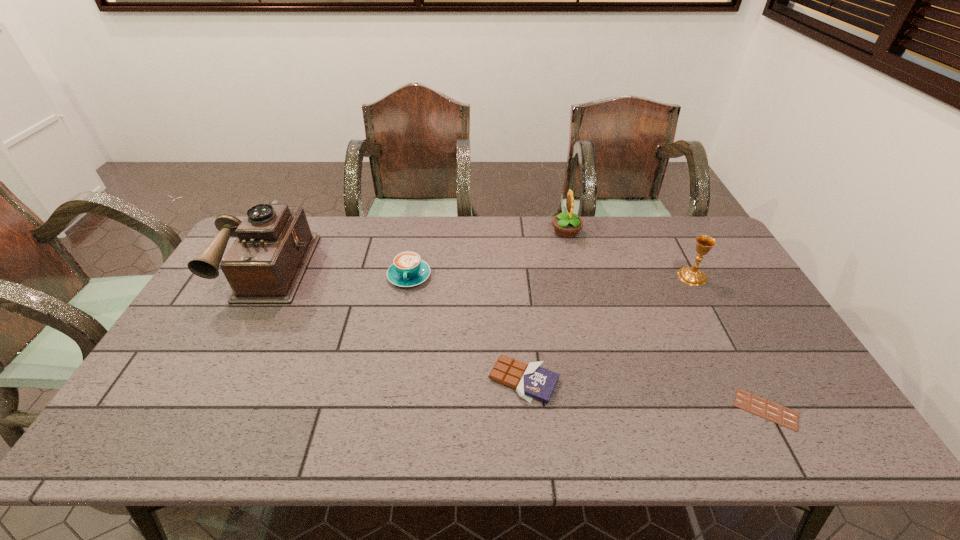
This screenshot has height=540, width=960. In order to click on vacant region that satisfies the following two spatial constraints: 1. on the face of the fourth object from left to right; 2. on the left side of the chalice in this screenshot , I will do `click(577, 276)`.

I want to click on free space in the image that satisfies the following two spatial constraints: 1. with the handle on the right side of the chalice; 2. on the right side of the third shortest object, so click(409, 276).

Identify the location of free point that satisfies the following two spatial constraints: 1. on the horn of the chalice; 2. on the right side of the phonograph_record. The height and width of the screenshot is (540, 960). (263, 276).

Image resolution: width=960 pixels, height=540 pixels. In order to click on vacant region that satisfies the following two spatial constraints: 1. on the horn of the tallest object; 2. on the left side of the chalice in this screenshot , I will do `click(263, 276)`.

This screenshot has height=540, width=960. In order to click on vacant area that satisfies the following two spatial constraints: 1. with the handle on the right side of the shortest object; 2. on the right side of the fourth tallest object in this screenshot , I will do `click(386, 409)`.

Identify the location of free spot that satisfies the following two spatial constraints: 1. with the handle on the right side of the chalice; 2. on the left side of the fifth object from right to left. Image resolution: width=960 pixels, height=540 pixels. (409, 276).

Locate an element on the screen. This screenshot has width=960, height=540. vacant space that satisfies the following two spatial constraints: 1. on the horn of the shortest object; 2. on the left side of the tallest object is located at coordinates [190, 409].

Where is `free space in the image that satisfies the following two spatial constraints: 1. with the handle on the right side of the chalice; 2. on the left side of the second object from left to right`? The width and height of the screenshot is (960, 540). free space in the image that satisfies the following two spatial constraints: 1. with the handle on the right side of the chalice; 2. on the left side of the second object from left to right is located at coordinates (409, 276).